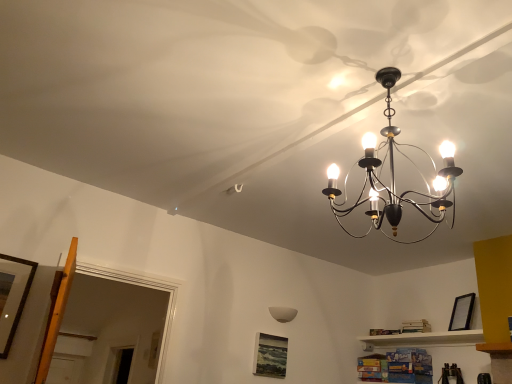
This screenshot has height=384, width=512. What do you see at coordinates (13, 296) in the screenshot?
I see `wooden picture frame at left, marked as the 3th picture frame in a bottom-to-top arrangement` at bounding box center [13, 296].

The height and width of the screenshot is (384, 512). What do you see at coordinates (270, 356) in the screenshot? I see `matte black picture frame at lower center, positioned as the 1th picture frame in back-to-front order` at bounding box center [270, 356].

What do you see at coordinates (462, 312) in the screenshot? I see `black matte picture frame at upper right, arranged as the second picture frame when ordered from the bottom` at bounding box center [462, 312].

Identify the location of black matte picture frame at upper right, arranged as the 2th picture frame when viewed from the top. Image resolution: width=512 pixels, height=384 pixels. (462, 312).

Locate an element on the screen. The width and height of the screenshot is (512, 384). wooden picture frame at left, the third picture frame from the back is located at coordinates (13, 296).

Which point is more distant from viewer, (295, 315) or (5, 271)?

Point (295, 315)

Would you say white matte lampshade at center contains wooden picture frame at left, marked as the 3th picture frame in a right-to-left arrangement?

Actually, wooden picture frame at left, marked as the 3th picture frame in a right-to-left arrangement, is outside white matte lampshade at center.

Does white matte lampshade at center appear on the left side of wooden picture frame at left, marked as the 3th picture frame in a bottom-to-top arrangement?

No.

Looking at this image, from a real-world perspective, is white matte lampshade at center on top of wooden picture frame at left, which is the 1th picture frame from front to back?

Yes, from a real-world perspective, white matte lampshade at center is above wooden picture frame at left, which is the 1th picture frame from front to back.

Is wooden picture frame at left, which is the 1th picture frame from front to back, looking in the opposite direction of black matte picture frame at upper right, arranged as the 2th picture frame when viewed from the top?

No.

Considering the positions of point (5, 319) and point (465, 298), is point (5, 319) closer or farther from the camera than point (465, 298)?

Point (5, 319).

Is wooden picture frame at left, which is the 1th picture frame from front to back, further to the viewer compared to black matte picture frame at upper right, arranged as the 2th picture frame when viewed from the top?

No, it is not.

Identify the location of the 2nd picture frame to the right of the wooden picture frame at left, marked as the 3th picture frame in a bottom-to-top arrangement, counting from the anchor's position. (462, 312).

Is wooden picture frame at left, marked as the 3th picture frame in a bottom-to-top arrangement, looking in the opposite direction of matte black picture frame at lower center, which ranks as the 1th picture frame in bottom-to-top order?

No, matte black picture frame at lower center, which ranks as the 1th picture frame in bottom-to-top order, is not at the back of wooden picture frame at left, marked as the 3th picture frame in a bottom-to-top arrangement.

Which is correct: wooden picture frame at left, marked as the 3th picture frame in a bottom-to-top arrangement, is inside matte black picture frame at lower center, which is counted as the third picture frame, starting from the front, or outside of it?

wooden picture frame at left, marked as the 3th picture frame in a bottom-to-top arrangement, is not enclosed by matte black picture frame at lower center, which is counted as the third picture frame, starting from the front.

Is point (31, 262) less distant than point (267, 336)?

Yes.

Is wooden picture frame at left, marked as the 3th picture frame in a right-to-left arrangement, with matte black picture frame at lower center, which ranks as the 1th picture frame in bottom-to-top order?

No, wooden picture frame at left, marked as the 3th picture frame in a right-to-left arrangement, is not in contact with matte black picture frame at lower center, which ranks as the 1th picture frame in bottom-to-top order.

Is wooden picture frame at left, which ranks as the first picture frame in top-to-bottom order, touching white matte lampshade at center?

wooden picture frame at left, which ranks as the first picture frame in top-to-bottom order, and white matte lampshade at center are clearly separated.

In the scene shown: Considering the relative sizes of wooden picture frame at left, the third picture frame from the back, and white matte lampshade at center in the image provided, is wooden picture frame at left, the third picture frame from the back, smaller than white matte lampshade at center?

Actually, wooden picture frame at left, the third picture frame from the back, might be larger than white matte lampshade at center.

Does wooden picture frame at left, marked as the 3th picture frame in a bottom-to-top arrangement, contain white matte lampshade at center?

That's incorrect, white matte lampshade at center is not inside wooden picture frame at left, marked as the 3th picture frame in a bottom-to-top arrangement.

How many degrees apart are the facing directions of wooden picture frame at left, the 1th picture frame from the left, and white matte lampshade at center?

wooden picture frame at left, the 1th picture frame from the left, and white matte lampshade at center are facing 3.23 degrees away from each other.

Which of these two, white matte lampshade at center or matte black picture frame at lower center, which ranks as the 1th picture frame in bottom-to-top order, is wider?

white matte lampshade at center.

Based on the photo, is white matte lampshade at center surrounding matte black picture frame at lower center, arranged as the third picture frame when viewed from the top?

No, matte black picture frame at lower center, arranged as the third picture frame when viewed from the top, is not inside white matte lampshade at center.

From a real-world perspective, is white matte lampshade at center located higher than matte black picture frame at lower center, the 2th picture frame when ordered from left to right?

Correct, in the physical world, white matte lampshade at center is higher than matte black picture frame at lower center, the 2th picture frame when ordered from left to right.

Which object is further away from the camera taking this photo, white matte lampshade at center or matte black picture frame at lower center, positioned as the 1th picture frame in back-to-front order?

white matte lampshade at center is further from the camera.

Is black matte picture frame at upper right, positioned as the third picture frame in left-to-right order, far away from white matte lampshade at center?

black matte picture frame at upper right, positioned as the third picture frame in left-to-right order, is far away from white matte lampshade at center.

Looking at the image, does black matte picture frame at upper right, arranged as the 2th picture frame when viewed from the top, seem bigger or smaller compared to white matte lampshade at center?

Considering their sizes, black matte picture frame at upper right, arranged as the 2th picture frame when viewed from the top, takes up more space than white matte lampshade at center.

Is black matte picture frame at upper right, positioned as the third picture frame in left-to-right order, positioned behind white matte lampshade at center?

No, black matte picture frame at upper right, positioned as the third picture frame in left-to-right order, is closer to the camera.

Based on the photo, is white matte lampshade at center a part of black matte picture frame at upper right, the 1th picture frame positioned from the right?

No, white matte lampshade at center is not a part of black matte picture frame at upper right, the 1th picture frame positioned from the right.

Considering the relative sizes of black matte picture frame at upper right, the second picture frame from the back, and matte black picture frame at lower center, positioned as the 1th picture frame in back-to-front order, in the image provided, is black matte picture frame at upper right, the second picture frame from the back, taller than matte black picture frame at lower center, positioned as the 1th picture frame in back-to-front order,?

In fact, black matte picture frame at upper right, the second picture frame from the back, may be shorter than matte black picture frame at lower center, positioned as the 1th picture frame in back-to-front order.

Based on the photo, how far apart are black matte picture frame at upper right, the 1th picture frame positioned from the right, and matte black picture frame at lower center, positioned as the 1th picture frame in back-to-front order?

black matte picture frame at upper right, the 1th picture frame positioned from the right, is 5.04 feet from matte black picture frame at lower center, positioned as the 1th picture frame in back-to-front order.

Which of these two, black matte picture frame at upper right, the 1th picture frame positioned from the right, or matte black picture frame at lower center, positioned as the 2th picture frame in right-to-left order, is bigger?

black matte picture frame at upper right, the 1th picture frame positioned from the right, is bigger.

From the picture: From a real-world perspective, which is physically above, black matte picture frame at upper right, arranged as the 2th picture frame when viewed from the top, or matte black picture frame at lower center, which ranks as the 1th picture frame in bottom-to-top order?

From a 3D spatial view, black matte picture frame at upper right, arranged as the 2th picture frame when viewed from the top, is above.

The width and height of the screenshot is (512, 384). I want to click on the 2nd picture frame counting from the left side of the white matte lampshade at center, so click(x=13, y=296).

Find the location of a particular element. The width and height of the screenshot is (512, 384). picture frame that is the 2nd object to the right of the wooden picture frame at left, marked as the 3th picture frame in a right-to-left arrangement, starting at the anchor is located at coordinates (462, 312).

From the image, which object appears to be farther from black matte picture frame at upper right, arranged as the 2th picture frame when viewed from the top, wooden picture frame at left, which ranks as the first picture frame in top-to-bottom order, or matte black picture frame at lower center, the 2th picture frame when ordered from left to right?

Based on the image, wooden picture frame at left, which ranks as the first picture frame in top-to-bottom order, appears to be further to black matte picture frame at upper right, arranged as the 2th picture frame when viewed from the top.

Estimate the real-world distances between objects in this image. Which object is closer to black matte picture frame at upper right, the 2th picture frame positioned from the front, white matte lampshade at center or matte black picture frame at lower center, arranged as the third picture frame when viewed from the top?

white matte lampshade at center is positioned closer to the anchor black matte picture frame at upper right, the 2th picture frame positioned from the front.

Consider the image. Which object lies nearer to the anchor point black matte picture frame at upper right, arranged as the second picture frame when ordered from the bottom, wooden picture frame at left, which ranks as the first picture frame in top-to-bottom order, or white matte lampshade at center?

white matte lampshade at center is closer to black matte picture frame at upper right, arranged as the second picture frame when ordered from the bottom.

Based on their spatial positions, is black matte picture frame at upper right, the second picture frame from the back, or wooden picture frame at left, marked as the 3th picture frame in a bottom-to-top arrangement, closer to white matte lampshade at center?

Among the two, black matte picture frame at upper right, the second picture frame from the back, is located nearer to white matte lampshade at center.

Estimate the real-world distances between objects in this image. Which object is closer to matte black picture frame at lower center, positioned as the 2th picture frame in right-to-left order, wooden picture frame at left, which ranks as the first picture frame in top-to-bottom order, or white matte lampshade at center?

white matte lampshade at center is closer to matte black picture frame at lower center, positioned as the 2th picture frame in right-to-left order.

Estimate the real-world distances between objects in this image. Which object is closer to white matte lampshade at center, wooden picture frame at left, which ranks as the first picture frame in top-to-bottom order, or matte black picture frame at lower center, arranged as the third picture frame when viewed from the top?

Among the two, matte black picture frame at lower center, arranged as the third picture frame when viewed from the top, is located nearer to white matte lampshade at center.

Which object lies nearer to the anchor point black matte picture frame at upper right, the 2th picture frame positioned from the front, matte black picture frame at lower center, positioned as the 1th picture frame in back-to-front order, or white matte lampshade at center?

white matte lampshade at center is positioned closer to the anchor black matte picture frame at upper right, the 2th picture frame positioned from the front.

Considering their positions, is wooden picture frame at left, marked as the 3th picture frame in a bottom-to-top arrangement, positioned further to matte black picture frame at lower center, arranged as the third picture frame when viewed from the top, than black matte picture frame at upper right, positioned as the third picture frame in left-to-right order?

wooden picture frame at left, marked as the 3th picture frame in a bottom-to-top arrangement, is positioned further to the anchor matte black picture frame at lower center, arranged as the third picture frame when viewed from the top.

This screenshot has width=512, height=384. In order to click on picture frame between wooden picture frame at left, marked as the 3th picture frame in a bottom-to-top arrangement, and black matte picture frame at upper right, the second picture frame from the back, from left to right in this screenshot , I will do `click(270, 356)`.

The width and height of the screenshot is (512, 384). I want to click on lamp between wooden picture frame at left, the 1th picture frame from the left, and black matte picture frame at upper right, the 1th picture frame positioned from the right, from left to right, so [x=283, y=314].

The height and width of the screenshot is (384, 512). Find the location of `picture frame between wooden picture frame at left, marked as the 3th picture frame in a bottom-to-top arrangement, and white matte lampshade at center from left to right`. picture frame between wooden picture frame at left, marked as the 3th picture frame in a bottom-to-top arrangement, and white matte lampshade at center from left to right is located at coordinates (270, 356).

At what (x,y) coordinates should I click in order to perform the action: click on lamp located between matte black picture frame at lower center, the 2th picture frame when ordered from left to right, and black matte picture frame at upper right, positioned as the third picture frame in left-to-right order, in the left-right direction. Please return your answer as a coordinate pair (x, y). Looking at the image, I should click on (283, 314).